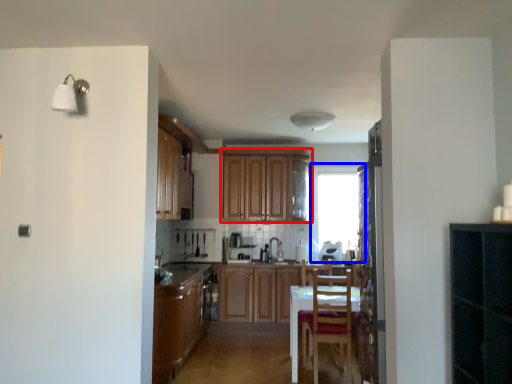
Question: Which object is further to the camera taking this photo, cabinetry (highlighted by a red box) or window (highlighted by a blue box)?

Choices:
 (A) cabinetry
 (B) window

Answer: (B)